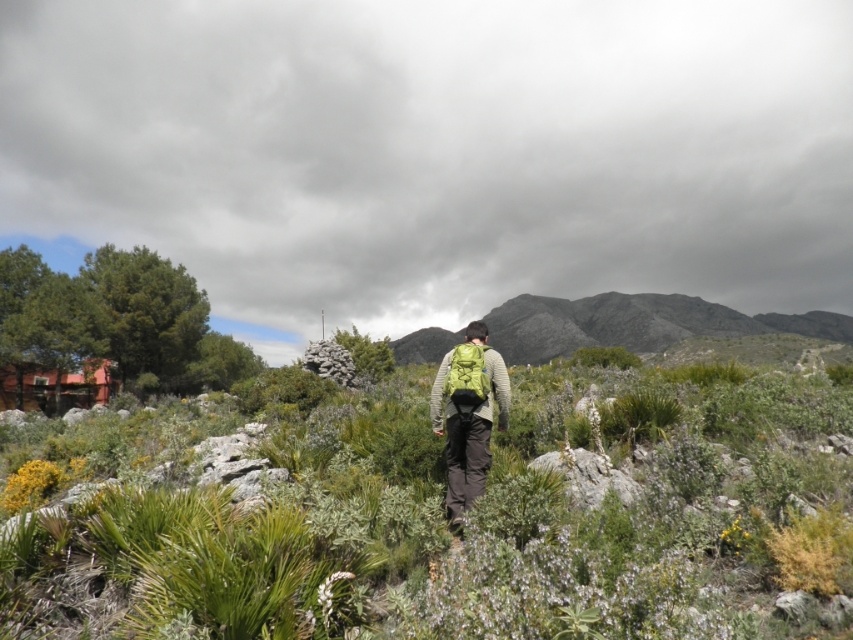
Which is more to the left, gray rocky mountain at center or green fabric backpack at center?

Positioned to the left is green fabric backpack at center.

Between point (552, 348) and point (453, 365), which one is positioned behind?

The point (552, 348) is more distant.

This screenshot has width=853, height=640. What are the coordinates of `gray rocky mountain at center` in the screenshot? It's located at (635, 323).